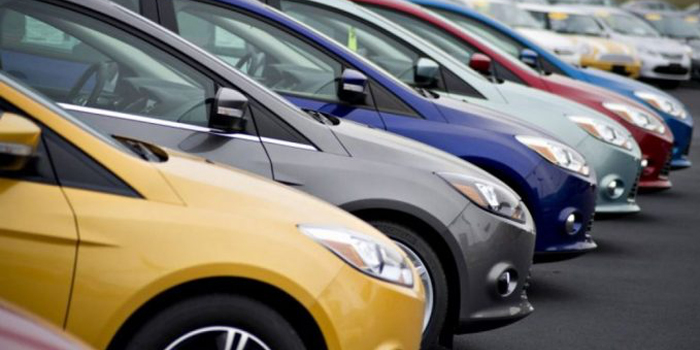
At what (x,y) coordinates should I click in order to perform the action: click on window. Please return your answer as a coordinate pair (x, y). The height and width of the screenshot is (350, 700). Looking at the image, I should click on (127, 86), (234, 43), (15, 157), (363, 32), (441, 31), (494, 24), (592, 22), (553, 21), (472, 8), (644, 10).